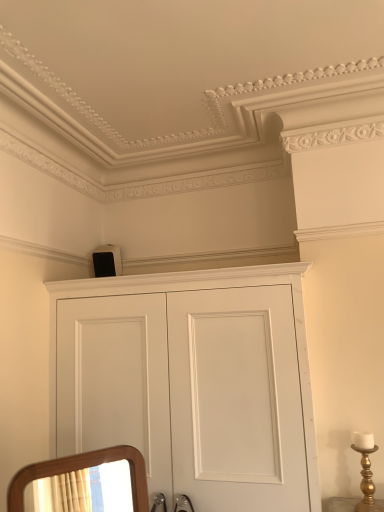
Question: From a real-world perspective, is white matte speaker at upper center physically located above or below gold metallic candle holder at right?

Choices:
 (A) below
 (B) above

Answer: (B)

Question: Considering the positions of white matte speaker at upper center and gold metallic candle holder at right in the image, is white matte speaker at upper center wider or thinner than gold metallic candle holder at right?

Choices:
 (A) thin
 (B) wide

Answer: (B)

Question: Estimate the real-world distances between objects in this image. Which object is farther from the gold metallic candle holder at right?

Choices:
 (A) white matte cupboard at upper center
 (B) white matte speaker at upper center

Answer: (B)

Question: Considering the real-world distances, which object is closest to the white matte cupboard at upper center?

Choices:
 (A) white matte speaker at upper center
 (B) gold metallic candle holder at right

Answer: (B)